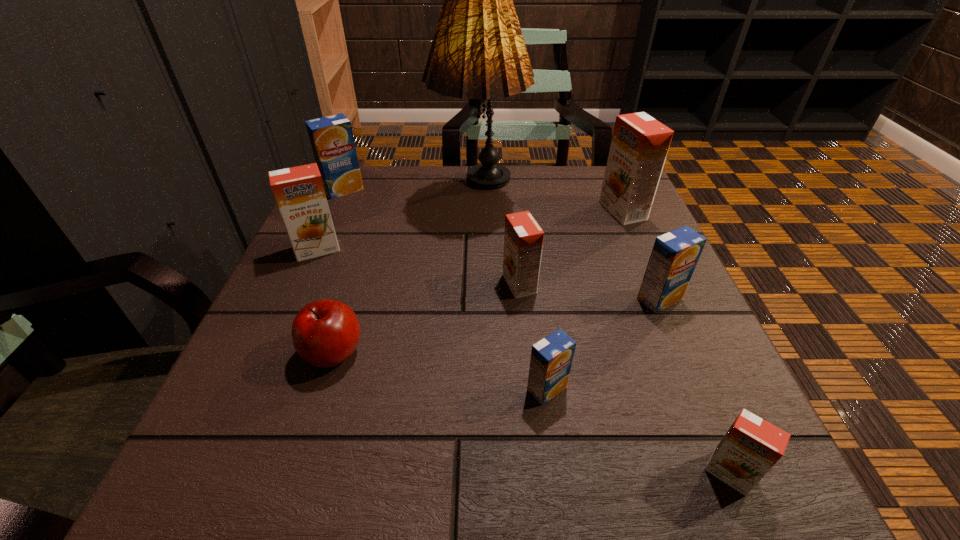
Where is `blank space located 0.360m on the front of the third biggest orange orange juice`? The height and width of the screenshot is (540, 960). blank space located 0.360m on the front of the third biggest orange orange juice is located at coordinates (540, 496).

You are a GUI agent. You are given a task and a screenshot of the screen. Output one action in this format:
    pyautogui.click(x=<x>, y=<y>)
    Task: Click on the free space located 0.310m on the back of the second smallest blue orange_juice
    The width and height of the screenshot is (960, 540).
    Given the screenshot: What is the action you would take?
    pos(617,200)

Where is `free region located on the left of the apple`? Image resolution: width=960 pixels, height=540 pixels. free region located on the left of the apple is located at coordinates (266, 353).

Image resolution: width=960 pixels, height=540 pixels. Identify the location of free spot located on the back of the second blue orange_juice from left to right. (532, 278).

In order to click on vacant space located on the back of the nearest orange orange juice in this screenshot , I will do `click(687, 373)`.

Locate an element on the screen. This screenshot has width=960, height=540. lampshade that is at the far edge is located at coordinates (478, 52).

The height and width of the screenshot is (540, 960). I want to click on object at the near edge, so click(x=751, y=447).

Where is `apple that is at the left edge`? apple that is at the left edge is located at coordinates (325, 333).

Locate an element on the screen. Image resolution: width=960 pixels, height=540 pixels. object present at the far left corner is located at coordinates (331, 137).

The width and height of the screenshot is (960, 540). In order to click on object that is at the far right corner in this screenshot , I will do `click(639, 146)`.